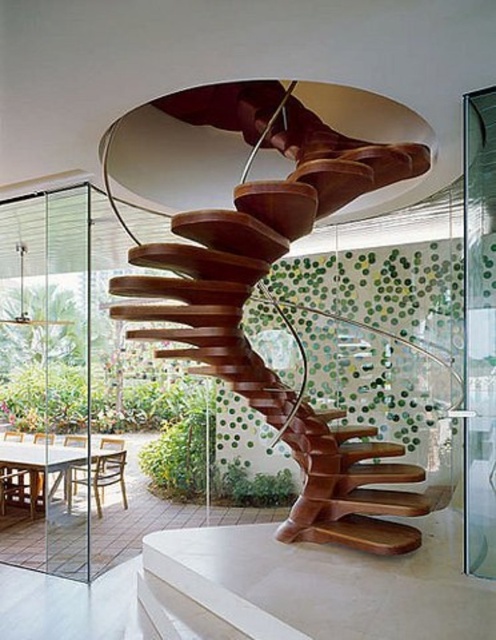
Does wooden spiral staircase at center appear over transparent glass door at left?

Correct, wooden spiral staircase at center is located above transparent glass door at left.

The height and width of the screenshot is (640, 496). In order to click on wooden spiral staircase at center in this screenshot , I will do `click(261, 278)`.

This screenshot has height=640, width=496. Identify the location of wooden spiral staircase at center. (261, 278).

Who is more forward, [51,566] or [493,358]?

Point [493,358]

This screenshot has width=496, height=640. What do you see at coordinates (46, 372) in the screenshot? I see `transparent glass door at left` at bounding box center [46, 372].

Where is `transparent glass door at left`? transparent glass door at left is located at coordinates (46, 372).

I want to click on transparent glass door at left, so click(x=46, y=372).

Which is in front, point (225, 275) or point (465, 160)?

Point (465, 160) is in front.

Can you confirm if wooden spiral staircase at center is positioned to the right of transparent glass door at right?

Incorrect, wooden spiral staircase at center is not on the right side of transparent glass door at right.

Between point (154, 244) and point (478, 122), which one is positioned behind?

Point (478, 122)

Locate an element on the screen. wooden spiral staircase at center is located at coordinates (261, 278).